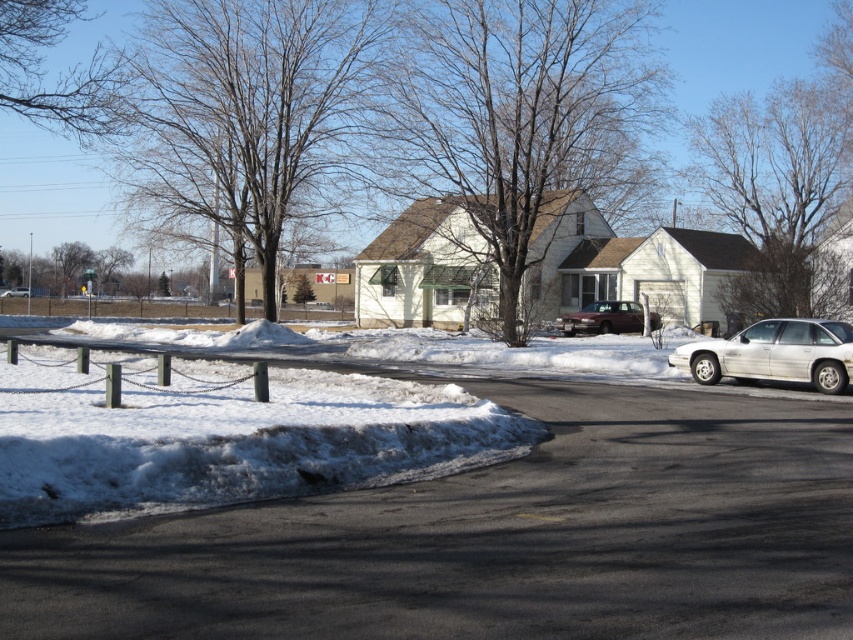
Looking at this image, you are a delivery driver who needs to park your vehicle near the brown matte suv at center without blocking the view of the bare branches at upper right. Is this possible given their current positions?

The bare branches at upper right are positioned over the brown matte suv at center, so parking near the brown matte suv at center might block the view of the branches. To avoid blocking the view, park on the side where the branches are not obstructed.

You are a delivery person trying to determine if the bare branches at upper right will block the view of the brown matte suv at center when driving along the road. Based on their heights, can you see the suv clearly?

The bare branches at upper right are taller than the brown matte suv at center, so they will block the view of the suv, making it difficult to see clearly.

You are standing on the road and want to walk towards the two points marked in the image. Which point, point (833, 262) or point (602, 305), will you reach first?

Point (833, 262) is closer to the viewer than point (602, 305), so you will reach point (833, 262) first.